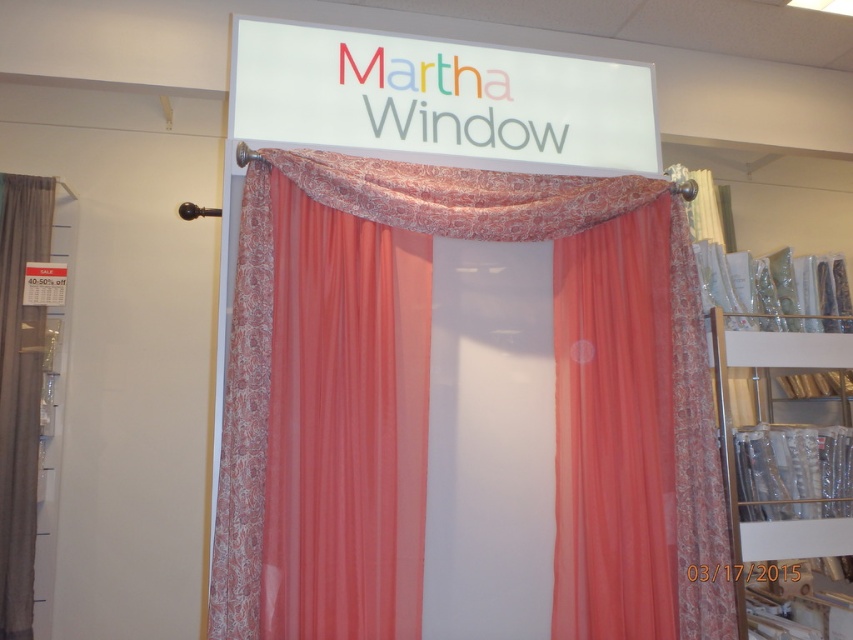
Based on the photo, can you confirm if coral sheer curtain at center is positioned to the left of metallic gold bookshelf at right?

Indeed, coral sheer curtain at center is positioned on the left side of metallic gold bookshelf at right.

Which is behind, point (374, 209) or point (758, 378)?

Positioned behind is point (758, 378).

The width and height of the screenshot is (853, 640). In order to click on coral sheer curtain at center in this screenshot , I will do `click(552, 237)`.

Between point (733, 428) and point (15, 204), which one is positioned behind?

The point (15, 204) is behind.

Does metallic gold bookshelf at right appear under matte gray curtain at left?

Correct, metallic gold bookshelf at right is located below matte gray curtain at left.

Describe the element at coordinates (787, 484) in the screenshot. I see `metallic gold bookshelf at right` at that location.

Locate an element on the screen. The width and height of the screenshot is (853, 640). metallic gold bookshelf at right is located at coordinates (787, 484).

Who is positioned more to the left, coral sheer curtain at center or matte gray curtain at left?

matte gray curtain at left

Does point (691, 445) come closer to viewer compared to point (26, 195)?

Yes, it is in front of point (26, 195).

At what (x,y) coordinates should I click in order to perform the action: click on coral sheer curtain at center. Please return your answer as a coordinate pair (x, y). Looking at the image, I should click on (552, 237).